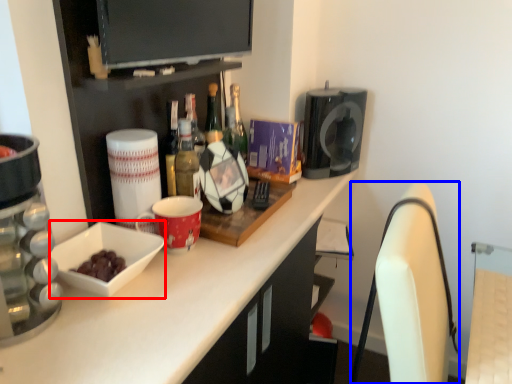
Question: Which object appears closest to the camera in this image, bowl (highlighted by a red box) or swivel chair (highlighted by a blue box)?

Choices:
 (A) bowl
 (B) swivel chair

Answer: (B)